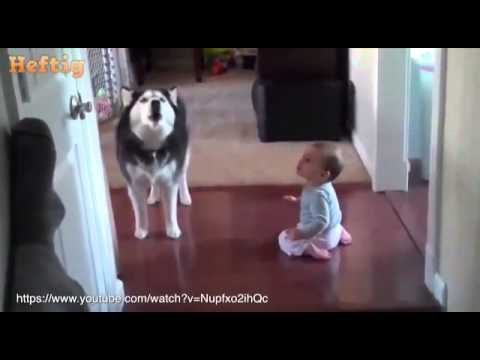
You are a GUI agent. You are given a task and a screenshot of the screen. Output one action in this format:
    pyautogui.click(x=<x>, y=<y>)
    Task: Click on the door
    
    Given the screenshot: What is the action you would take?
    pyautogui.click(x=67, y=119), pyautogui.click(x=422, y=114)